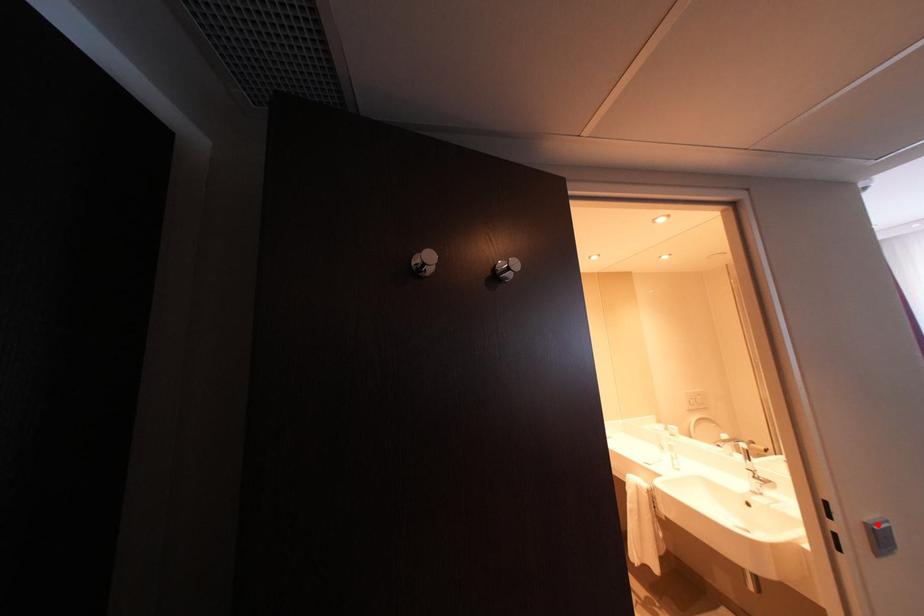
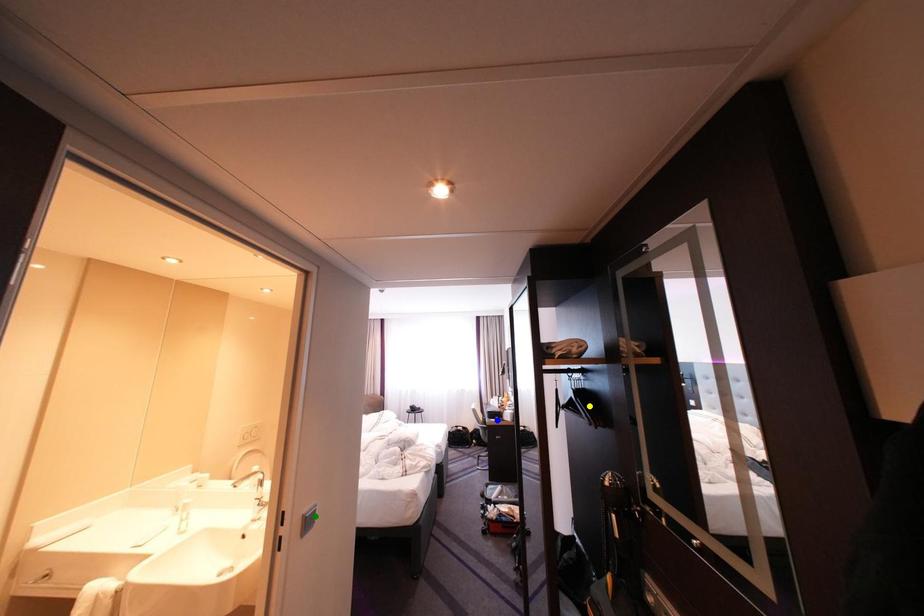
Question: I am providing you with two images of the same scene from different viewpoints. A red point is marked on the first image. You are given multiple points on the second image. Which spot in image 2 lines up with the point in image 1?

Choices:
 (A) blue point
 (B) yellow point
 (C) green point

Answer: (C)